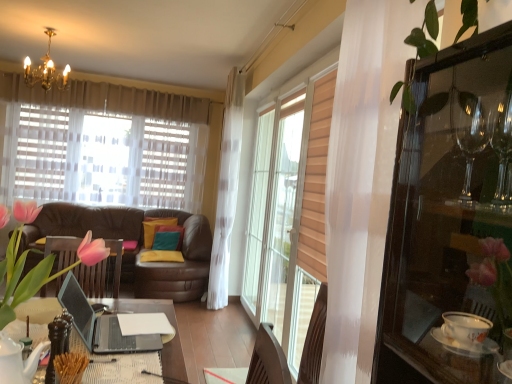
Question: From the image's perspective, is yellow fabric pillow at center, the third pillow from the back, positioned above or below pink silk tulips at center?

Choices:
 (A) above
 (B) below

Answer: (B)

Question: Based on their sizes in the image, would you say yellow fabric pillow at center, the third pillow from the back, is bigger or smaller than pink silk tulips at center?

Choices:
 (A) small
 (B) big

Answer: (A)

Question: Estimate the real-world distances between objects in this image. Which object is farther from the pink silk tulips at center?

Choices:
 (A) yellow fabric pillow at center, the third pillow from the back
 (B) teal fabric pillow at center, which ranks as the third pillow in front-to-back order
 (C) teal fabric pillow at center, placed as the 2th pillow when sorted from front to back
 (D) transparent glass cabinet at right

Answer: (B)

Question: Which object is the closest to the transparent glass cabinet at right?

Choices:
 (A) yellow fabric pillow at center, the third pillow from the back
 (B) teal fabric pillow at center, marked as the 1th pillow in a back-to-front arrangement
 (C) pink silk tulips at center
 (D) teal fabric pillow at center, which ranks as the second pillow in back-to-front order

Answer: (C)